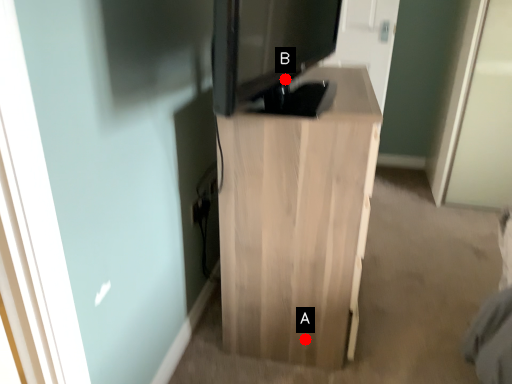
Question: Two points are circled on the image, labeled by A and B beside each circle. Which point is closer to the camera taking this photo?

Choices:
 (A) A is closer
 (B) B is closer

Answer: (B)